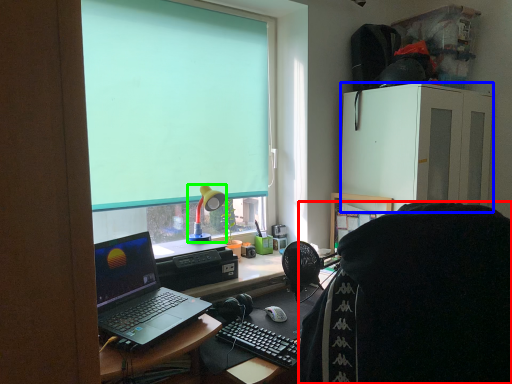
Question: Considering the real-world distances, which object is closest to person (highlighted by a red box)? cabinetry (highlighted by a blue box) or lamp (highlighted by a green box).

Choices:
 (A) cabinetry
 (B) lamp

Answer: (B)